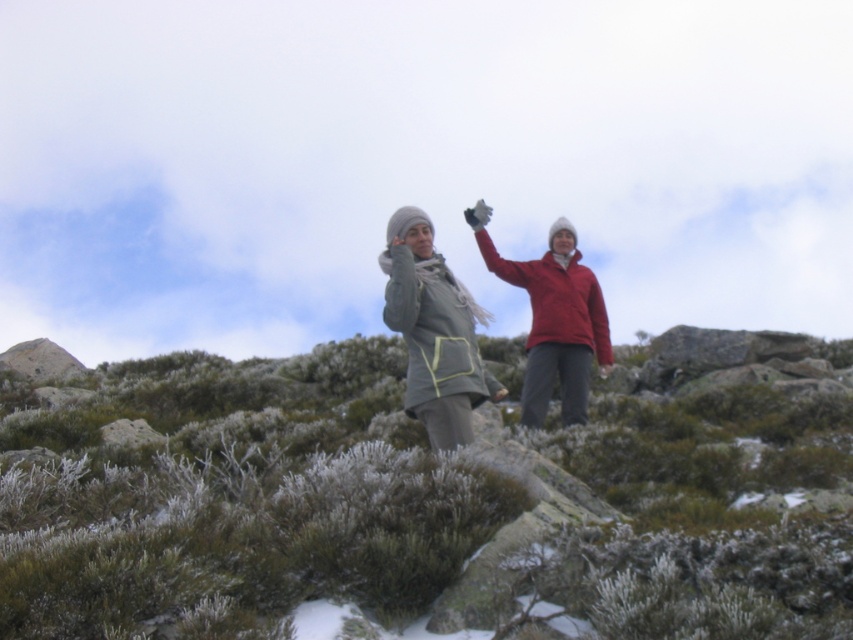
You are a photographer trying to capture a landscape photo. You have two points marked in your viewfinder at coordinates point (x=329, y=417) and point (x=494, y=394). Which point is closer to your camera lens?

Point (x=494, y=394) is closer to the camera lens because it is less further than point (x=329, y=417) according to the description.

You are planning to take a photo of the matte gray jacket at center and the green mossy rocks at center. Which object should you focus on first if you want to capture both in the same frame without moving the camera?

The green mossy rocks at center is bigger than the matte gray jacket at center, so you should focus on the green mossy rocks at center first to ensure it fits properly in the frame before adjusting for the smaller matte gray jacket at center.

Based on the photo, you are a hiker trying to take a photo of the green mossy rocks at center and the matte gray jacket at center. Which object should you focus on first if you want to capture both in a single frame without moving your camera? Explain your reasoning based on their sizes in the image.

The green mossy rocks at center has a lesser height compared to matte gray jacket at center, so you should focus on the matte gray jacket at center first since it is taller and might require more attention in the frame to ensure both are captured properly.